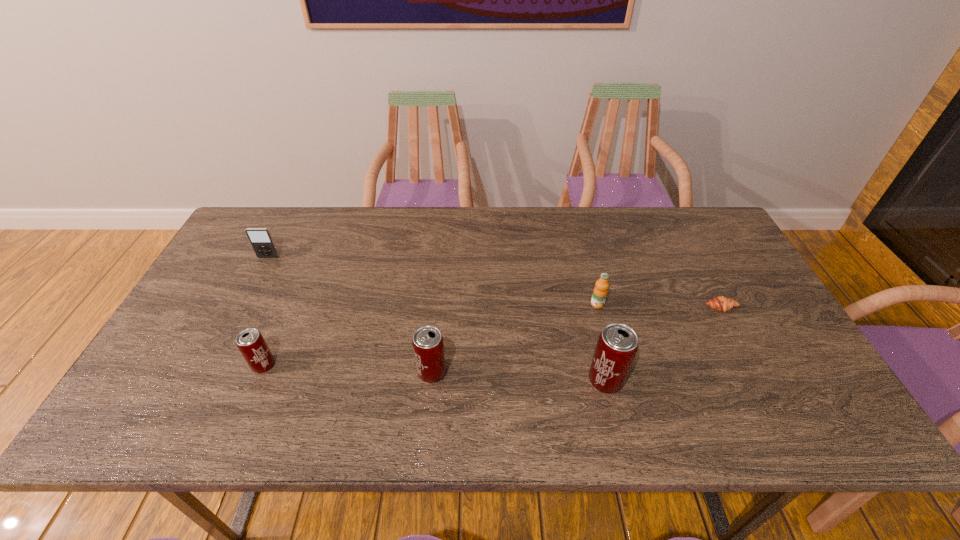
The beer cans are evenly distributed in the image. To maintain this, where would you place another beer can on the right? Please point to a free space. Please provide its 2D coordinates. Your answer should be formatted as a tuple, i.e. [(x, y)], where the tuple contains the x and y coordinates of a point satisfying the conditions above.

[(784, 388)]